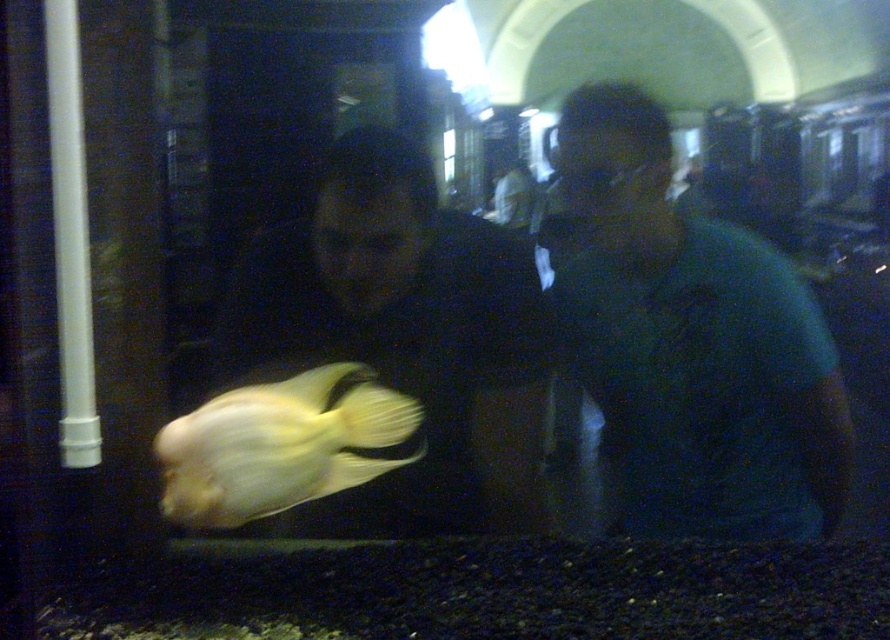
Which is more to the left, green matte shirt at center or smooth yellow fish at left?

smooth yellow fish at left

Does green matte shirt at center lie behind smooth yellow fish at left?

Yes, it is.

Which is in front, point (837, 388) or point (227, 298)?

Point (837, 388) is more forward.

You are a GUI agent. You are given a task and a screenshot of the screen. Output one action in this format:
    pyautogui.click(x=<x>, y=<y>)
    Task: Click on the green matte shirt at center
    The image size is (890, 640).
    Given the screenshot: What is the action you would take?
    pyautogui.click(x=689, y=342)

Is green matte shirt at center to the right of translucent yellow fish at center from the viewer's perspective?

Yes, green matte shirt at center is to the right of translucent yellow fish at center.

Based on the photo, between green matte shirt at center and translucent yellow fish at center, which one is positioned higher?

green matte shirt at center is above.

The image size is (890, 640). Describe the element at coordinates (689, 342) in the screenshot. I see `green matte shirt at center` at that location.

This screenshot has width=890, height=640. I want to click on green matte shirt at center, so click(x=689, y=342).

Who is positioned more to the right, smooth yellow fish at left or translucent yellow fish at center?

Positioned to the right is smooth yellow fish at left.

Which is below, smooth yellow fish at left or translucent yellow fish at center?

translucent yellow fish at center

Find the location of a particular element. This screenshot has height=640, width=890. smooth yellow fish at left is located at coordinates (403, 339).